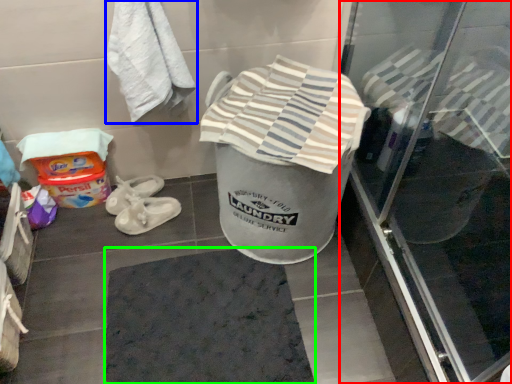
Question: Which is nearer to the screen door (highlighted by a red box)? towel (highlighted by a blue box) or bath mat (highlighted by a green box).

Choices:
 (A) towel
 (B) bath mat

Answer: (B)